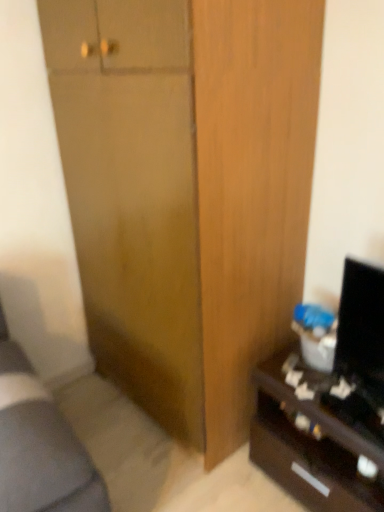
What do you see at coordinates (187, 192) in the screenshot? The width and height of the screenshot is (384, 512). I see `wooden cabinet at center` at bounding box center [187, 192].

Locate an element on the screen. Image resolution: width=384 pixels, height=512 pixels. wooden cabinet at center is located at coordinates (187, 192).

The image size is (384, 512). What do you see at coordinates (303, 452) in the screenshot?
I see `black glossy desk at lower right` at bounding box center [303, 452].

In order to face black glossy desk at lower right, should I rotate leftwards or rightwards?

A 18.977 degree turn to the right will do.

Identify the location of black glossy desk at lower right. (303, 452).

Locate an element on the screen. This screenshot has height=512, width=384. wooden cabinet at center is located at coordinates 187,192.

Considering the relative positions of black glossy desk at lower right and wooden cabinet at center in the image provided, is black glossy desk at lower right to the right of wooden cabinet at center from the viewer's perspective?

Yes.

Considering the relative positions of black glossy desk at lower right and wooden cabinet at center in the image provided, is black glossy desk at lower right in front of wooden cabinet at center?

No.

Is point (318, 422) positioned after point (207, 101)?

Yes.

From the image's perspective, between black glossy desk at lower right and wooden cabinet at center, who is located below?

black glossy desk at lower right, from the image's perspective.

From a real-world perspective, is black glossy desk at lower right below wooden cabinet at center?

Indeed, from a real-world perspective, black glossy desk at lower right is positioned beneath wooden cabinet at center.

Is black glossy desk at lower right wider or thinner than wooden cabinet at center?

Considering their sizes, black glossy desk at lower right looks slimmer than wooden cabinet at center.

Can you confirm if black glossy desk at lower right is taller than wooden cabinet at center?

In fact, black glossy desk at lower right may be shorter than wooden cabinet at center.

Consider the image. Looking at the image, does black glossy desk at lower right seem bigger or smaller compared to wooden cabinet at center?

Considering their sizes, black glossy desk at lower right takes up less space than wooden cabinet at center.

Consider the image. Is wooden cabinet at center inside black glossy desk at lower right?

No, black glossy desk at lower right does not contain wooden cabinet at center.

Is there a large distance between black glossy desk at lower right and wooden cabinet at center?

No, black glossy desk at lower right is not far from wooden cabinet at center.

Is black glossy desk at lower right oriented away from wooden cabinet at center?

That's not correct — black glossy desk at lower right is not looking away from wooden cabinet at center.

Consider the image. What's the angular difference between black glossy desk at lower right and wooden cabinet at center's facing directions?

3.26 degrees.

Measure the distance from black glossy desk at lower right to wooden cabinet at center.

black glossy desk at lower right is 21.91 inches away from wooden cabinet at center.

The width and height of the screenshot is (384, 512). There is a black glossy desk at lower right. In order to click on cabinetry above it (from a real-world perspective) in this screenshot , I will do `click(187, 192)`.

Which object is positioned more to the right, wooden cabinet at center or black glossy desk at lower right?

From the viewer's perspective, black glossy desk at lower right appears more on the right side.

Is wooden cabinet at center in front of black glossy desk at lower right?

Yes, it is.

Is point (237, 322) closer or farther from the camera than point (316, 479)?

Point (237, 322) appears to be farther away from the viewer than point (316, 479).

From the image's perspective, between wooden cabinet at center and black glossy desk at lower right, which one is located above?

wooden cabinet at center is shown above in the image.

From a real-world perspective, which is physically above, wooden cabinet at center or black glossy desk at lower right?

In real-world perspective, wooden cabinet at center is above.

Between wooden cabinet at center and black glossy desk at lower right, which one has smaller width?

black glossy desk at lower right is thinner.

Does wooden cabinet at center have a greater height compared to black glossy desk at lower right?

Correct, wooden cabinet at center is much taller as black glossy desk at lower right.

Does wooden cabinet at center have a larger size compared to black glossy desk at lower right?

Indeed, wooden cabinet at center has a larger size compared to black glossy desk at lower right.

Would you say wooden cabinet at center is inside or outside black glossy desk at lower right?

wooden cabinet at center is not enclosed by black glossy desk at lower right.

Is wooden cabinet at center positioned far away from black glossy desk at lower right?

No, wooden cabinet at center is not far from black glossy desk at lower right.

Is black glossy desk at lower right at the back of wooden cabinet at center?

No, wooden cabinet at center is not facing the opposite direction of black glossy desk at lower right.

Can you tell me how much wooden cabinet at center and black glossy desk at lower right differ in facing direction?

They differ by 3.26 degrees in their facing directions.

Based on the photo, how far apart are wooden cabinet at center and black glossy desk at lower right?

wooden cabinet at center is 21.91 inches away from black glossy desk at lower right.

This screenshot has width=384, height=512. In the image, there is a wooden cabinet at center. Find the location of `desk below it (from the image's perspective)`. desk below it (from the image's perspective) is located at coordinates [303, 452].

Find the location of a particular element. This screenshot has width=384, height=512. cabinetry above the black glossy desk at lower right (from the image's perspective) is located at coordinates (187, 192).

Find the location of a particular element. This screenshot has width=384, height=512. desk behind the wooden cabinet at center is located at coordinates (303, 452).